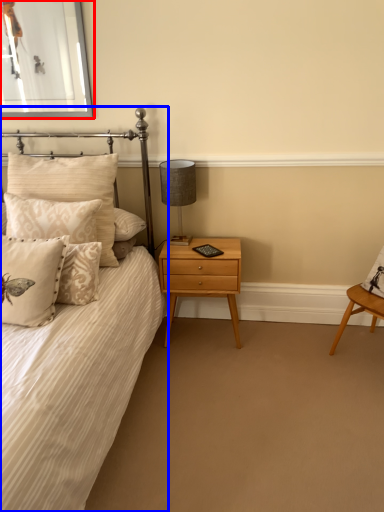
Question: Which of the following is the closest to the observer, picture frame (highlighted by a red box) or bed (highlighted by a blue box)?

Choices:
 (A) picture frame
 (B) bed

Answer: (B)